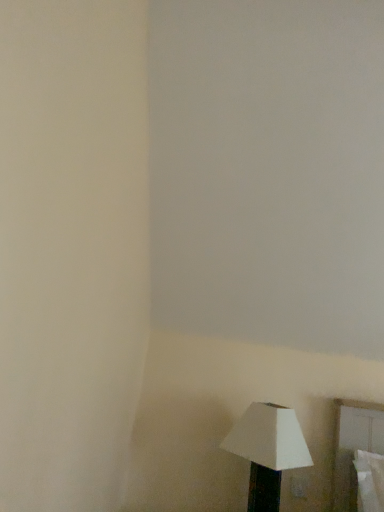
What is the approximate width of white matte lamp at lower right?

white matte lamp at lower right is 31.20 centimeters wide.

What do you see at coordinates (268, 451) in the screenshot? I see `white matte lamp at lower right` at bounding box center [268, 451].

Where is `white matte lamp at lower right`? The width and height of the screenshot is (384, 512). white matte lamp at lower right is located at coordinates (268, 451).

The height and width of the screenshot is (512, 384). Identify the location of white matte lamp at lower right. (268, 451).